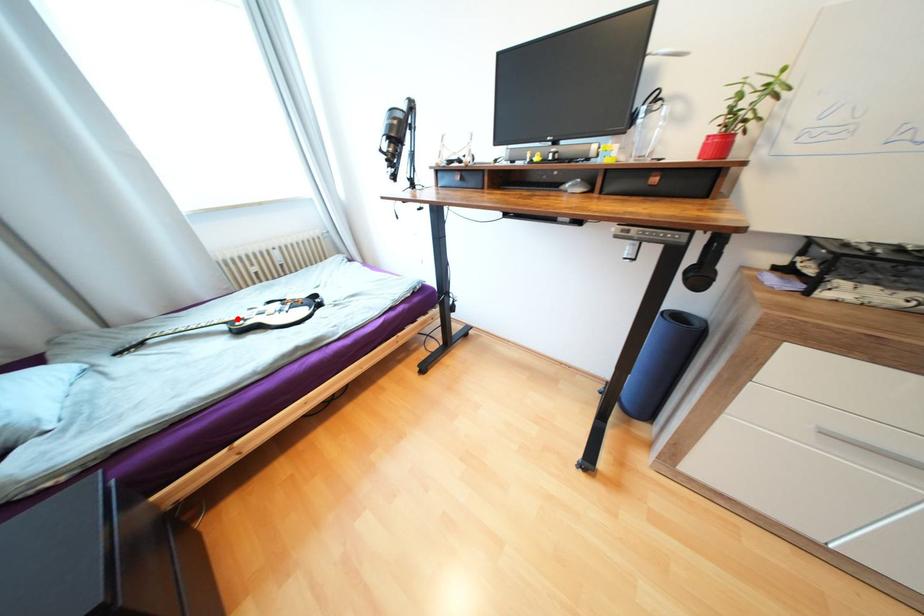
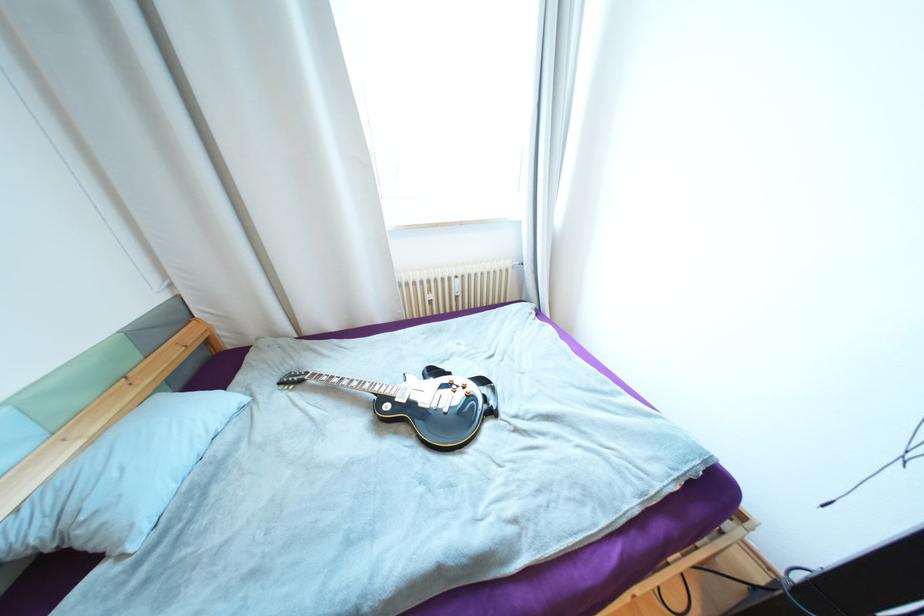
Question: I am providing you with two images of the same scene from different viewpoints. A red point is marked on the first image. Is the red point's position out of view in image 2?

Choices:
 (A) Yes
 (B) No

Answer: (B)